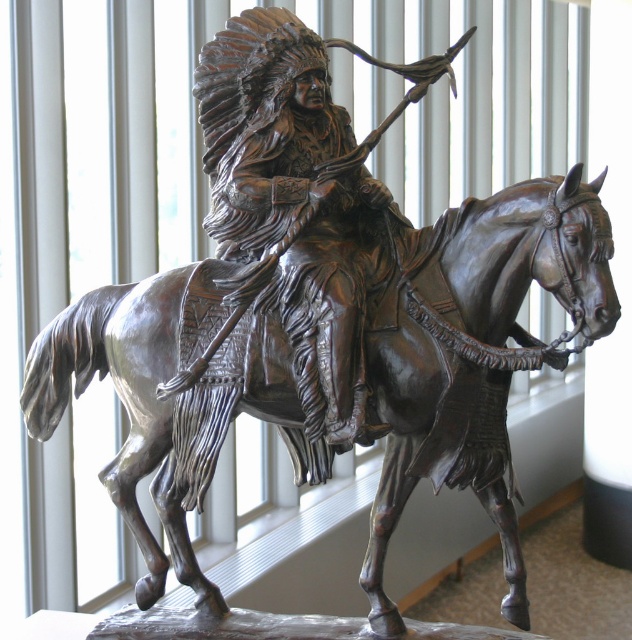
Question: Is bronze horse at center to the left of bronze statue at center from the viewer's perspective?

Choices:
 (A) yes
 (B) no

Answer: (B)

Question: Which object appears closest to the camera in this image?

Choices:
 (A) bronze statue at center
 (B) bronze horse at center

Answer: (B)

Question: Is bronze horse at center to the left of bronze statue at center from the viewer's perspective?

Choices:
 (A) no
 (B) yes

Answer: (A)

Question: Among these points, which one is farthest from the camera?

Choices:
 (A) (344, 397)
 (B) (442, 278)

Answer: (B)

Question: Does bronze horse at center have a larger size compared to bronze statue at center?

Choices:
 (A) no
 (B) yes

Answer: (B)

Question: Which point is closer to the camera taking this photo?

Choices:
 (A) (252, 70)
 (B) (465, 387)

Answer: (B)